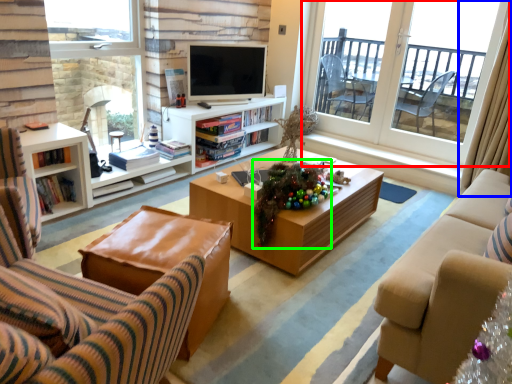
Question: Considering the real-world distances, which object is closest to window (highlighted by a red box)? curtain (highlighted by a blue box) or christmas decoration (highlighted by a green box).

Choices:
 (A) curtain
 (B) christmas decoration

Answer: (A)